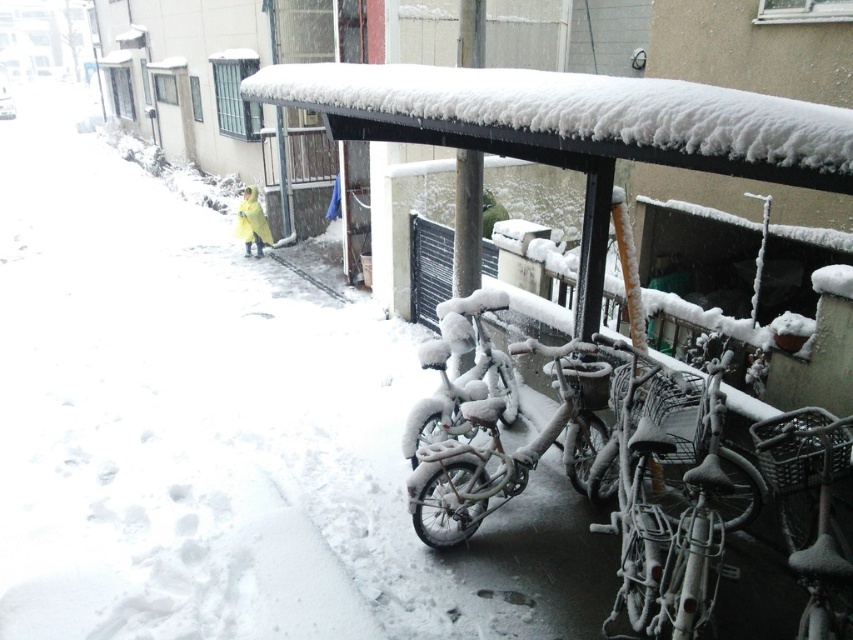
You are standing at the point marked by the coordinate (506, 452) in the snowy urban scene. What object are you directly positioned on?

The point marked by the coordinate (506, 452) is directly positioned on the snow covered metal bicycle at center.